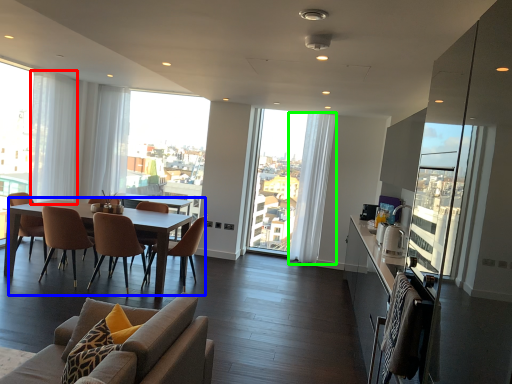
Question: Based on their relative distances, which object is farther from curtain (highlighted by a red box)? Choose from coffee table (highlighted by a blue box) and curtain (highlighted by a green box).

Choices:
 (A) coffee table
 (B) curtain

Answer: (B)